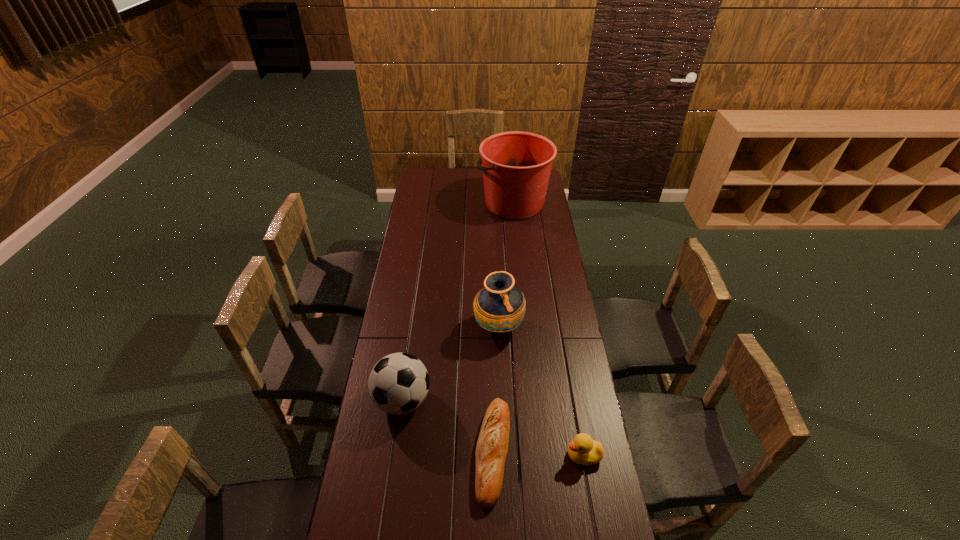
Where is `vacant point located between the baguet and the third shortest object`? vacant point located between the baguet and the third shortest object is located at coordinates (448, 426).

Locate an element on the screen. The height and width of the screenshot is (540, 960). free space between the baguet and the fourth shortest object is located at coordinates (496, 389).

Locate an element on the screen. The width and height of the screenshot is (960, 540). unoccupied position between the soccer ball and the shortest object is located at coordinates (448, 426).

Where is `object that is the second closest one to the soccer ball`? Image resolution: width=960 pixels, height=540 pixels. object that is the second closest one to the soccer ball is located at coordinates (500, 307).

Image resolution: width=960 pixels, height=540 pixels. I want to click on object that is the closest to the pottery, so click(398, 383).

This screenshot has width=960, height=540. In order to click on free space that satisfies the following two spatial constraints: 1. on the front side of the leftmost object; 2. on the right side of the baguet in this screenshot , I will do `click(396, 451)`.

Locate an element on the screen. free space that satisfies the following two spatial constraints: 1. on the front side of the baguet; 2. on the left side of the soccer ball is located at coordinates (396, 451).